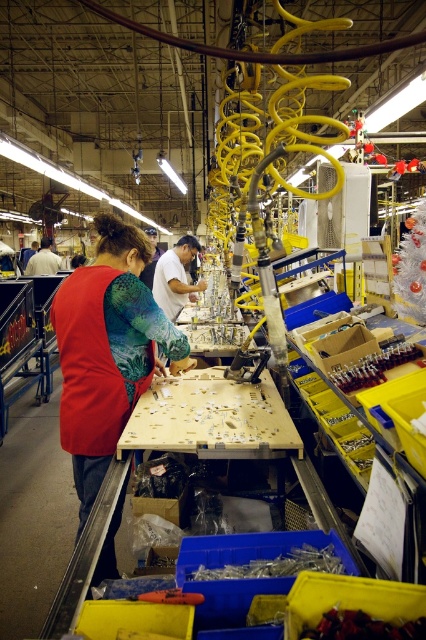
You are a quality control inspector in the factory. You need to check if the metallic silver screwdriver at lower right can fit into a storage box that is the same height as the red fabric shirt at center. Can it fit?

The metallic silver screwdriver at lower right has a lesser height compared to the red fabric shirt at center. Since the storage box is the same height as the red fabric shirt at center, the screwdriver will fit inside the box.

You are a quality control inspector in the factory. You need to compare the width of the metallic silver screwdriver at lower right and the red fabric shirt at center to ensure they meet safety standards. Which object is narrower?

The metallic silver screwdriver at lower right is narrower than the red fabric shirt at center.